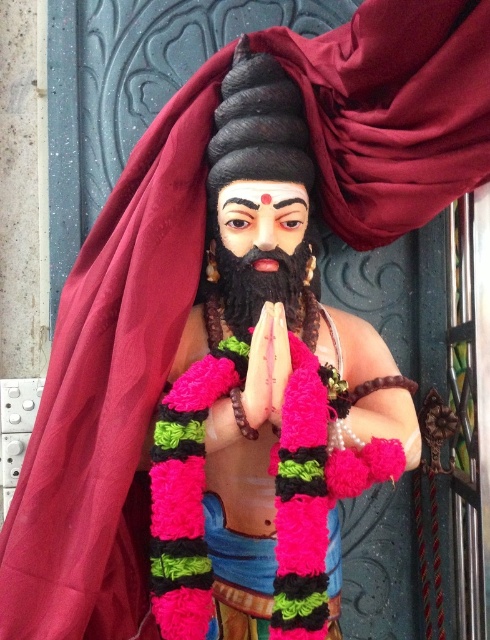
Where is the polished wood statue at center located in the image?

The polished wood statue at center is located at point (265, 396) in the image.